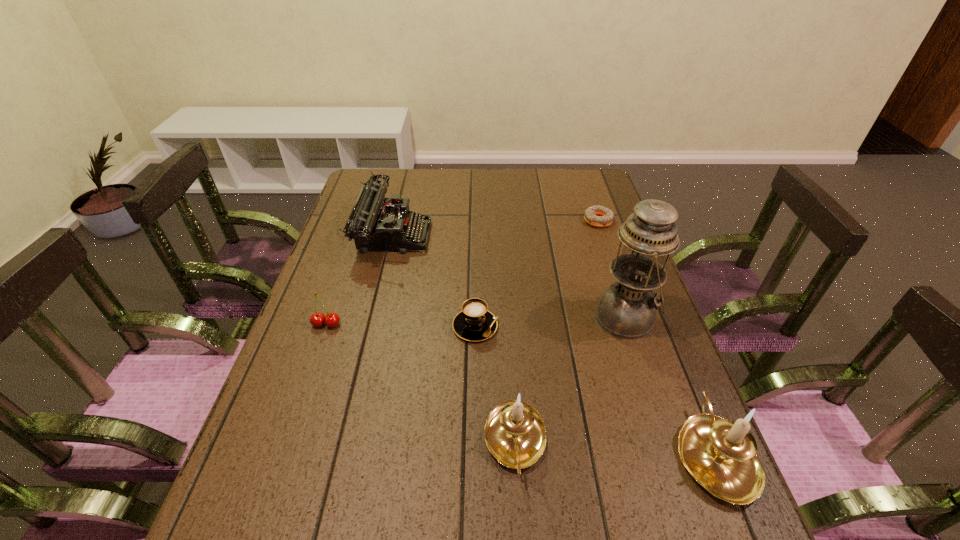
Please show where to add a candle holder on the left while keeping spacing even. Please provide its 2D coordinates. Your answer should be formatted as a tuple, i.e. [(x, y)], where the tuple contains the x and y coordinates of a point satisfying the conditions above.

[(324, 430)]